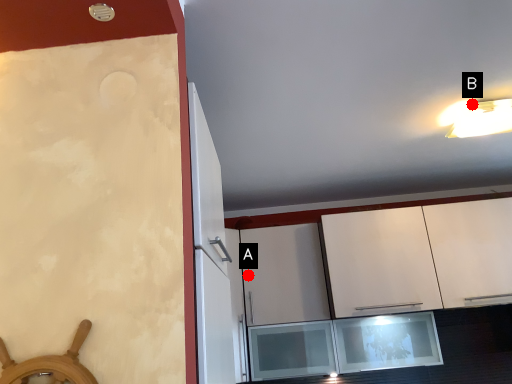
Question: Two points are circled on the image, labeled by A and B beside each circle. Which of the following is the farthest from the observer?

Choices:
 (A) A is further
 (B) B is further

Answer: (A)